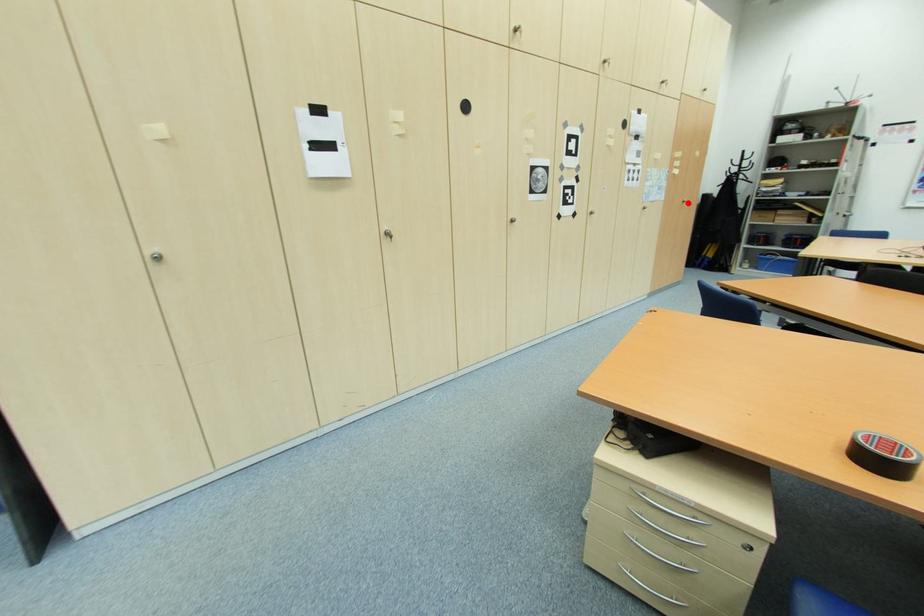
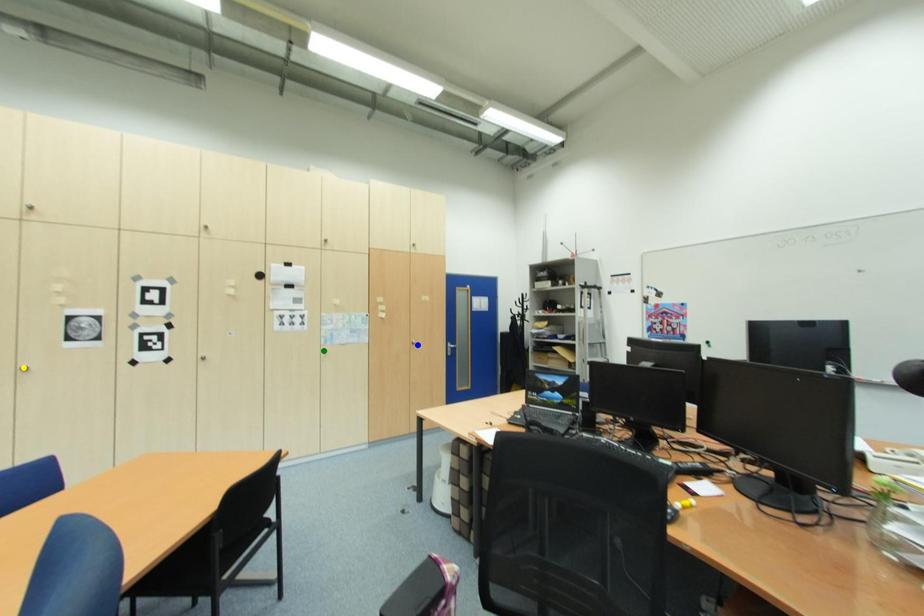
Question: I am providing you with two images of the same scene from different viewpoints. A red point is marked on the first image. You are given multiple points on the second image. Which mark in image 2 goes with the point in image 1?

Choices:
 (A) blue point
 (B) yellow point
 (C) green point

Answer: (A)